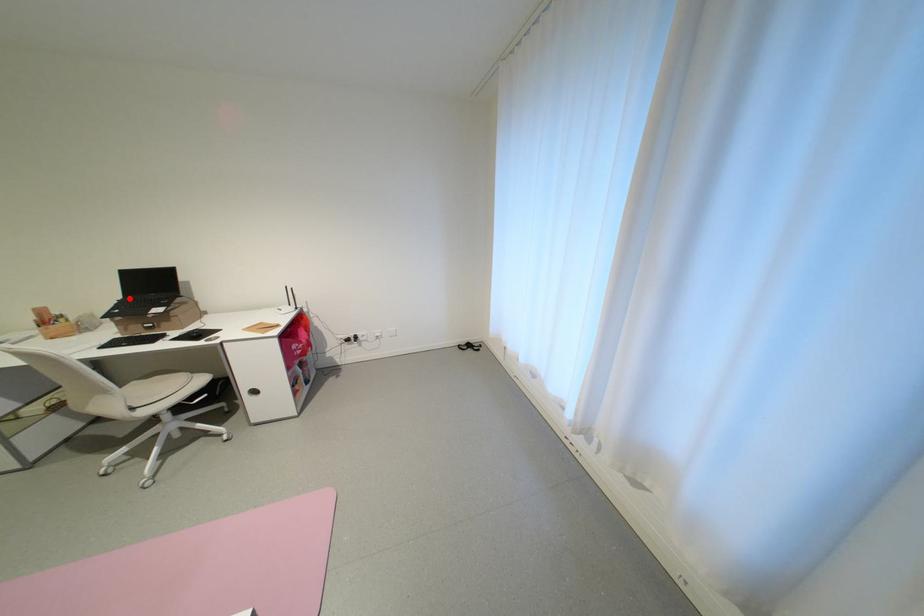
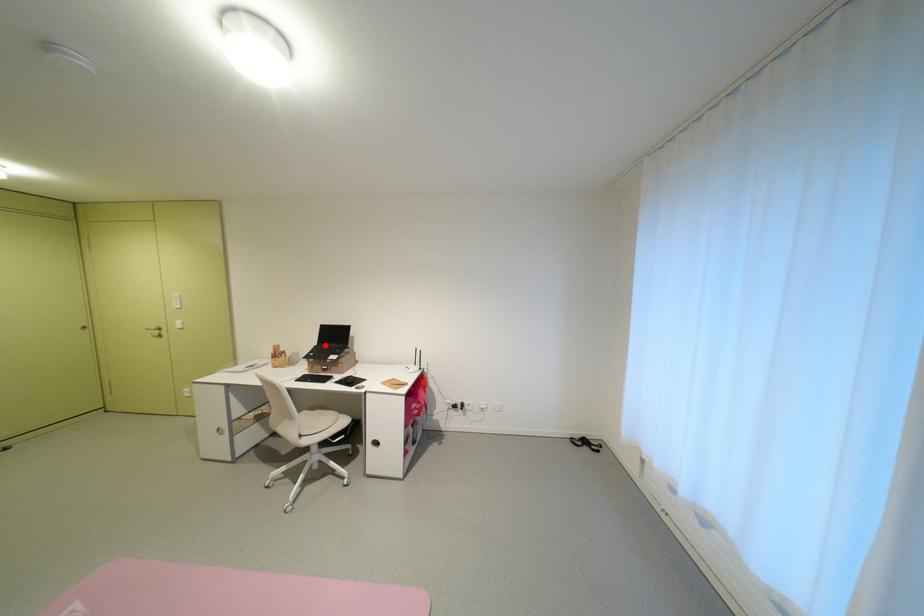
I am providing you with two images of the same scene from different viewpoints. A red point is marked on the first image and another point is marked on the second image. Are the points marked in image1 and image2 representing the same 3D position?

Yes